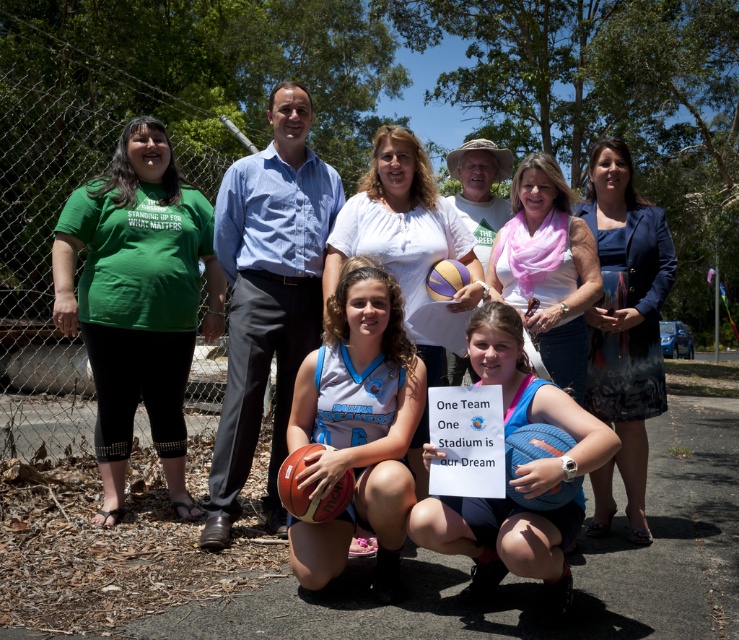
You are a photographer standing at the edge of the scene. You want to take a photo that includes both the pink scarf at center and the yellow matte basketball at center. What is the minimum distance you need to move backward to ensure both objects are in frame?

The minimum distance you need to move backward is 55.02 centimeters to ensure both the pink scarf at center and the yellow matte basketball at center are in frame.